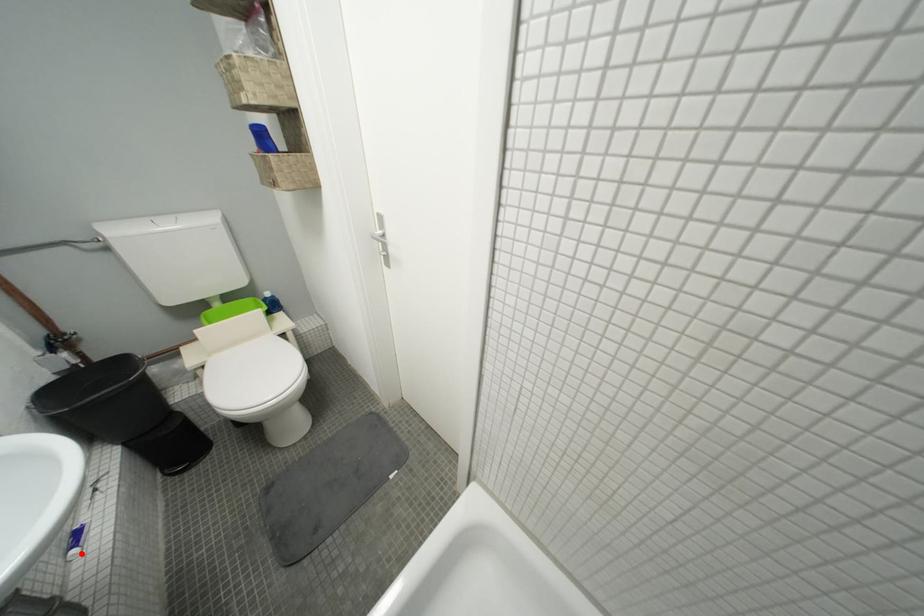
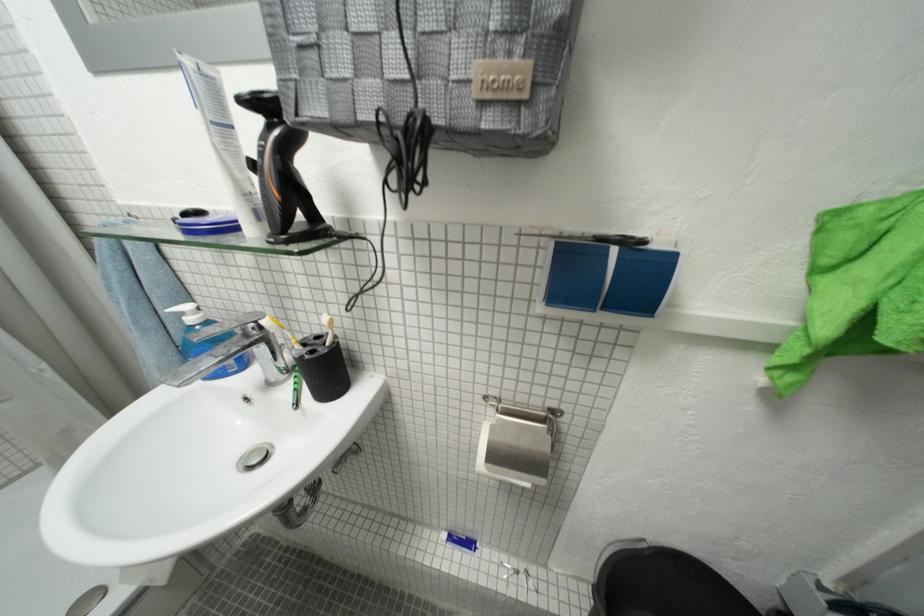
Question: I am providing you with two images of the same scene from different viewpoints. Given a red point in image1, look at the same physical point in image2. Is it:

Choices:
 (A) Closer to the viewpoint
 (B) Farther from the viewpoint

Answer: (A)